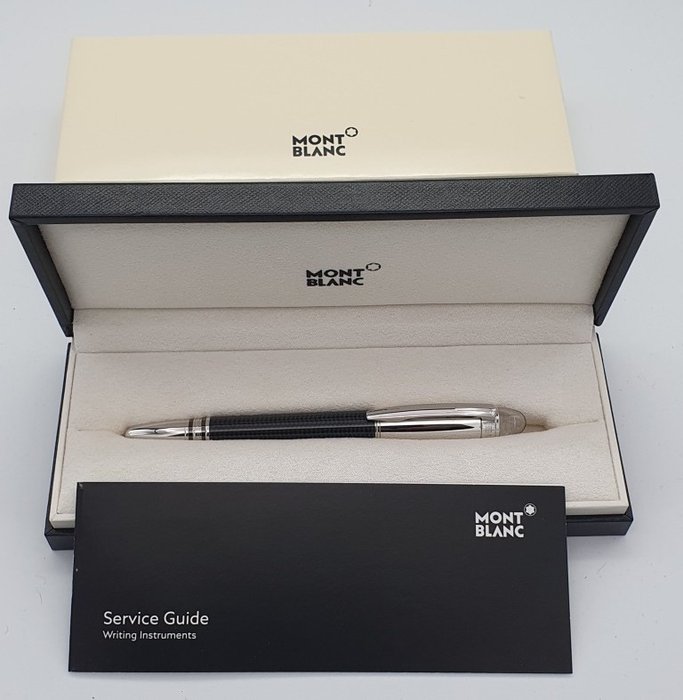
Identify the location of silver metallic pen handle. (408, 413).